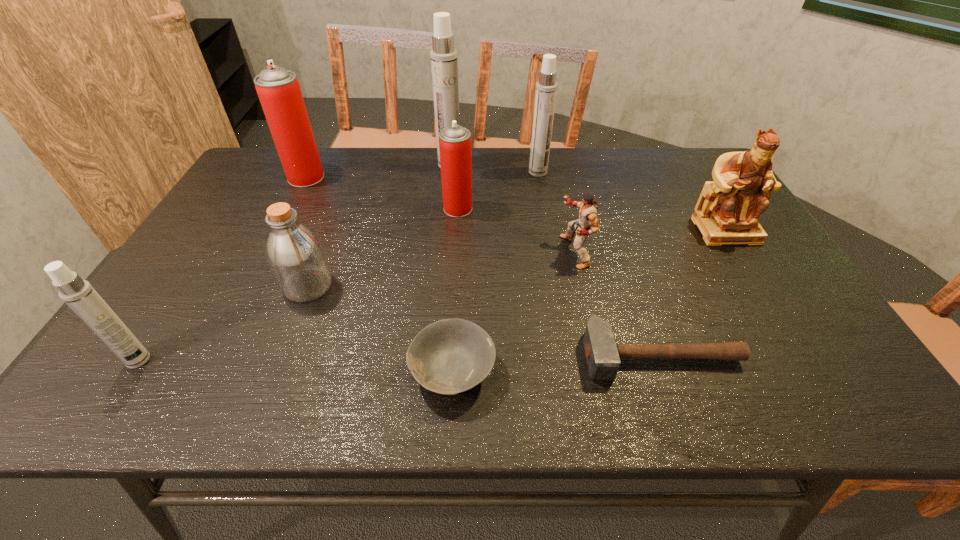
The image size is (960, 540). Find the location of `object located in the far left corner section of the desktop`. object located in the far left corner section of the desktop is located at coordinates (278, 89).

In the image, there is a desktop. Identify the location of free region at the far edge. click(577, 175).

You are a GUI agent. You are given a task and a screenshot of the screen. Output one action in this format:
    pyautogui.click(x=<x>, y=<y>)
    Task: Click on the free space at the near edge of the desktop
    
    Given the screenshot: What is the action you would take?
    pyautogui.click(x=606, y=386)

This screenshot has width=960, height=540. In order to click on vacant area at the left edge in this screenshot , I will do `click(218, 239)`.

You are a GUI agent. You are given a task and a screenshot of the screen. Output one action in this format:
    pyautogui.click(x=<x>, y=<y>)
    Task: Click on the vacant space at the far left corner
    
    Given the screenshot: What is the action you would take?
    pyautogui.click(x=254, y=161)

I want to click on blank space at the near right corner of the desktop, so (x=787, y=373).

Image resolution: width=960 pixels, height=540 pixels. What are the coordinates of `vacant region between the second white aerosol can from left to right and the puncher` in the screenshot? It's located at (512, 208).

Find the location of a particular element. This screenshot has height=540, width=960. unoccupied position between the second smallest white aerosol can and the tallest object is located at coordinates (493, 168).

I want to click on vacant area between the bottle and the gray bowl, so click(380, 328).

Where is `empty space between the rightmost object and the second biggest white aerosol can`? empty space between the rightmost object and the second biggest white aerosol can is located at coordinates tap(632, 201).